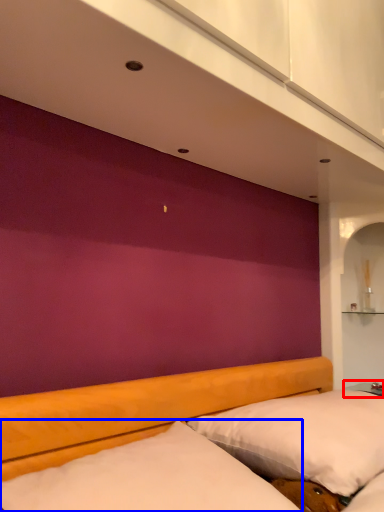
Question: Which object is closer to the camera taking this photo, table (highlighted by a red box) or mattress (highlighted by a blue box)?

Choices:
 (A) table
 (B) mattress

Answer: (B)